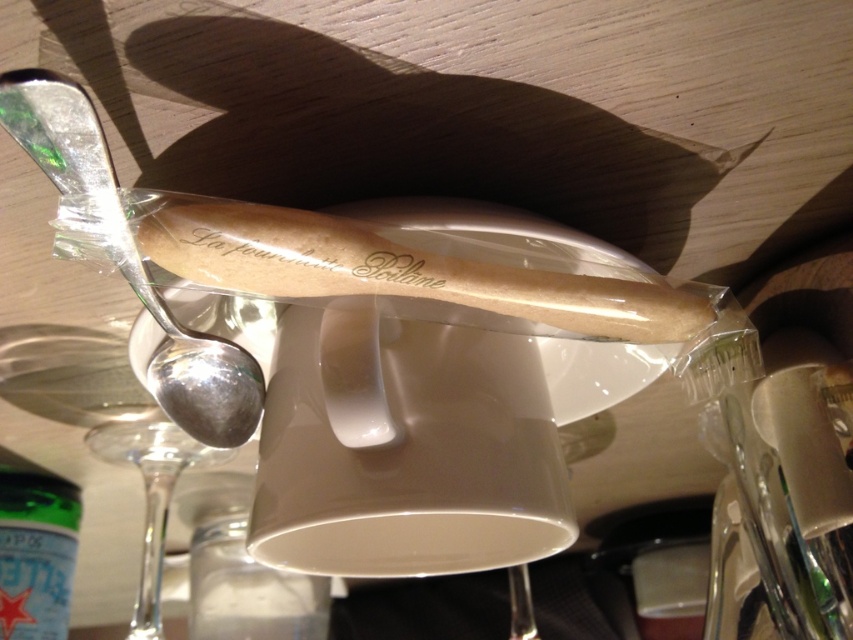
Question: Which of the following is the farthest from the observer?

Choices:
 (A) coord(61,172)
 (B) coord(151,579)

Answer: (B)

Question: Can you confirm if green matte bottle at lower left is positioned to the right of transparent glass wine glass at lower left?

Choices:
 (A) yes
 (B) no

Answer: (B)

Question: Which of the following is the closest to the observer?

Choices:
 (A) transparent glass wine glass at lower left
 (B) silver polished spoon at upper left

Answer: (B)

Question: Is silver polished spoon at upper left further to camera compared to green matte bottle at lower left?

Choices:
 (A) no
 (B) yes

Answer: (A)

Question: Does silver polished spoon at upper left have a greater width compared to green matte bottle at lower left?

Choices:
 (A) yes
 (B) no

Answer: (A)

Question: Which of the following is the farthest from the observer?

Choices:
 (A) silver polished spoon at upper left
 (B) transparent glass wine glass at lower left

Answer: (B)